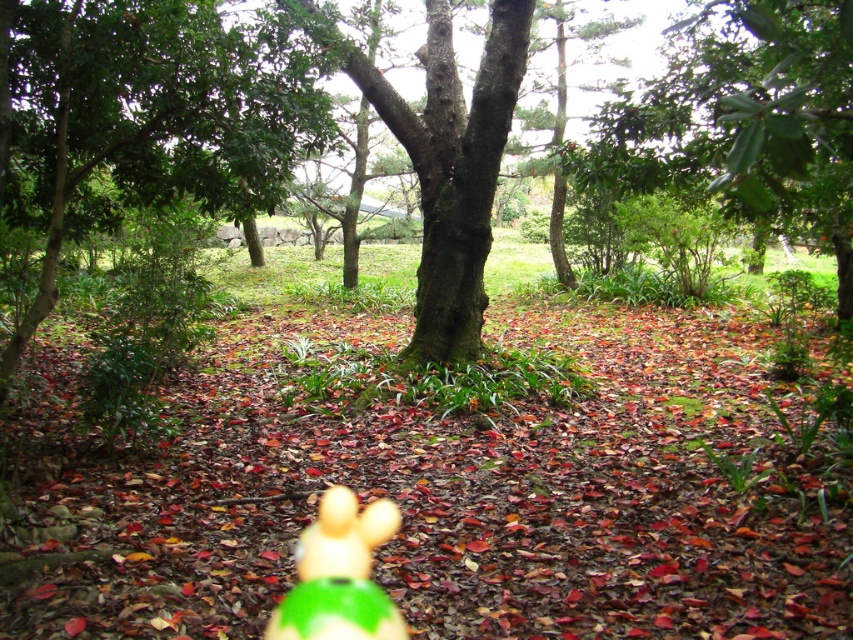
Question: Based on their relative distances, which object is nearer to the green leafy tree at center?

Choices:
 (A) green leafy tree at upper right
 (B) green matte toy at center
 (C) green mossy tree at center

Answer: (C)

Question: In this image, where is green leafy tree at center located relative to green leafy tree at upper right?

Choices:
 (A) above
 (B) below

Answer: (A)

Question: Among these points, which one is nearest to the camera?

Choices:
 (A) (335, 502)
 (B) (437, 333)

Answer: (A)

Question: Is green leafy tree at center smaller than green mossy tree at center?

Choices:
 (A) yes
 (B) no

Answer: (B)

Question: Which point is closer to the camera taking this photo?

Choices:
 (A) click(x=326, y=508)
 (B) click(x=462, y=99)

Answer: (A)

Question: Can you confirm if green leafy tree at center is positioned above green matte toy at center?

Choices:
 (A) no
 (B) yes

Answer: (B)